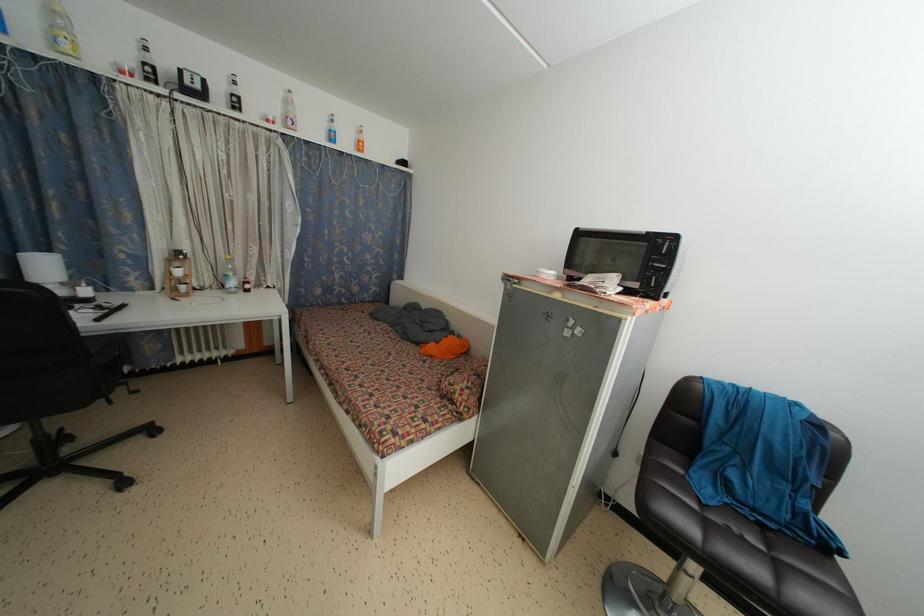
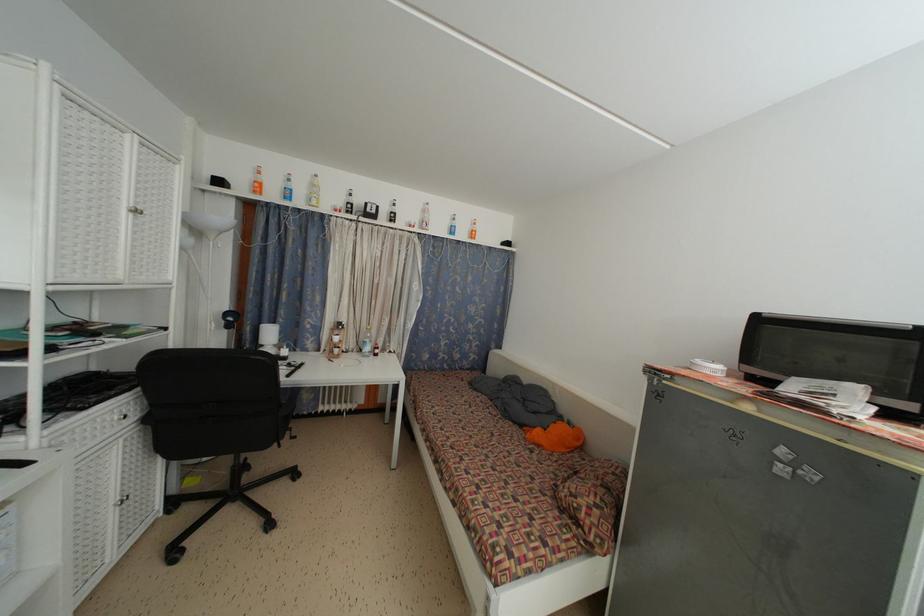
Question: Based on the continuous images, in which direction is the camera rotating? Reply with the corresponding letter.

Choices:
 (A) Left
 (B) Right
 (C) Up
 (D) Down

Answer: (A)